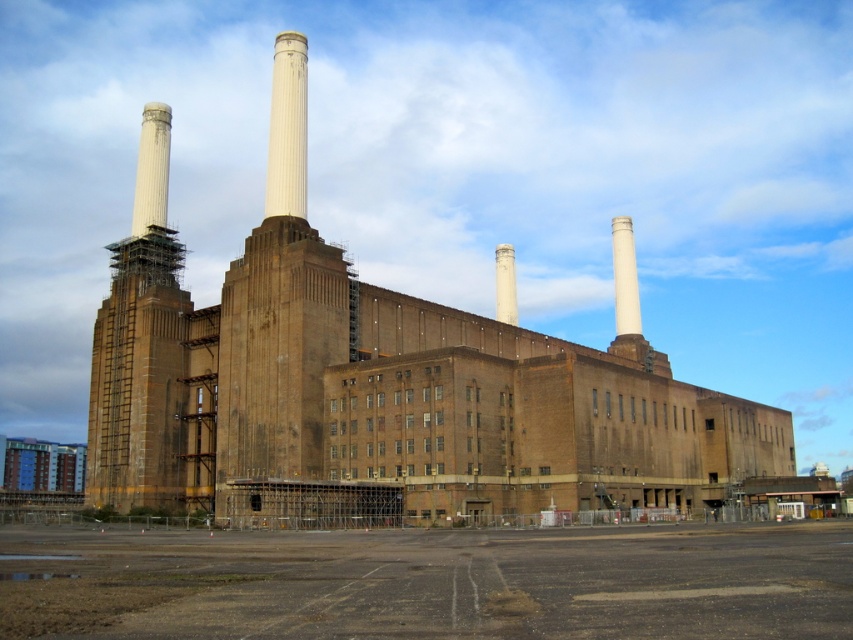
You are standing at a viewpoint 200 feet away from the industrial building. You want to reach the point marked as point [219,406] on the building. Is the distance you need to cover shorter than 250 feet?

The distance of point [219,406] from viewer is 250.13 feet. Since you are currently 200 feet away from the building, the total distance to reach point [219,406] would be 200 feet plus 250.13 feet, which is longer than 250 feet.

You are standing in front of the industrial building and want to determine the relative positions of two points marked on the building. Which point is closer to you, point at position (247, 477) or point at position (502, 266)?

Point at position (247, 477) is closer to you than point at position (502, 266).

You are standing at point A, which is located at coordinates (x=389, y=385). What structure can you see directly in front of you?

The brown brick building at center is located at point (x=389, y=385), so you can see the brown brick building at center directly in front of you.